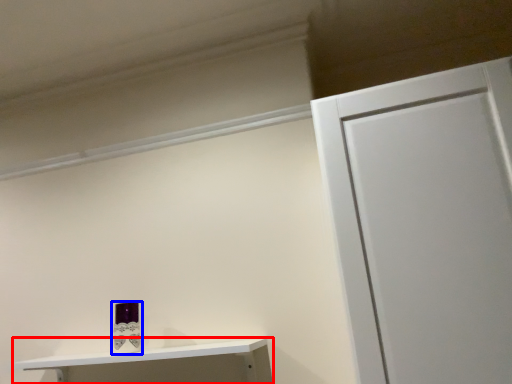
Question: Which of the following is the closest to the observer, shelf (highlighted by a red box) or toiletry (highlighted by a blue box)?

Choices:
 (A) shelf
 (B) toiletry

Answer: (A)